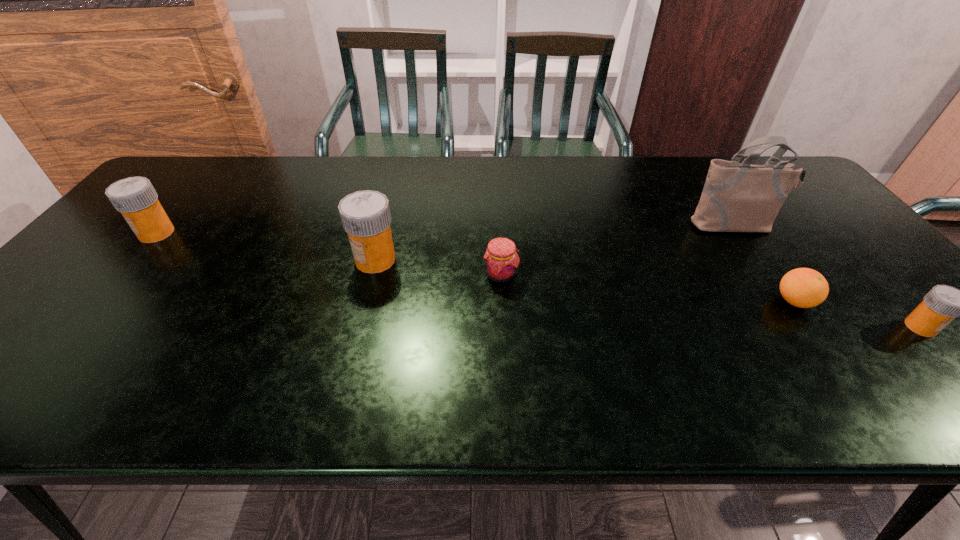
To make them evenly spaced by inserting another medicine among them, please locate a vacant spot for this new medicine. Please provide its 2D coordinates. Your answer should be formatted as a tuple, i.e. [(x, y)], where the tuple contains the x and y coordinates of a point satisfying the conditions above.

[(627, 291)]